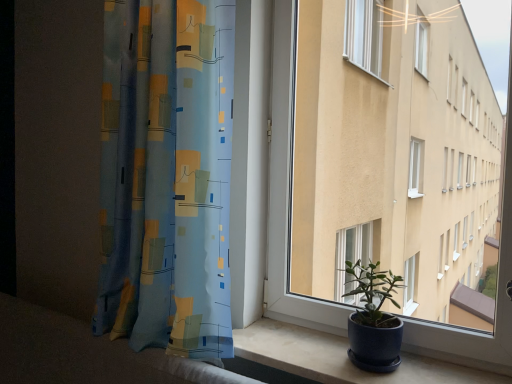
Question: Is blue fabric curtain at left facing towards matte concrete window sill at lower right?

Choices:
 (A) yes
 (B) no

Answer: (B)

Question: Can you see blue fabric curtain at left touching matte concrete window sill at lower right?

Choices:
 (A) no
 (B) yes

Answer: (A)

Question: Considering the relative sizes of blue fabric curtain at left and matte concrete window sill at lower right in the image provided, is blue fabric curtain at left smaller than matte concrete window sill at lower right?

Choices:
 (A) yes
 (B) no

Answer: (B)

Question: Does blue fabric curtain at left have a larger size compared to matte concrete window sill at lower right?

Choices:
 (A) yes
 (B) no

Answer: (A)

Question: Is blue fabric curtain at left in front of matte concrete window sill at lower right?

Choices:
 (A) no
 (B) yes

Answer: (A)

Question: Is blue fabric curtain at left to the left of matte concrete window sill at lower right from the viewer's perspective?

Choices:
 (A) yes
 (B) no

Answer: (A)

Question: Are blue fabric curtain at left and matte white window at center far apart?

Choices:
 (A) no
 (B) yes

Answer: (A)

Question: Can you confirm if blue fabric curtain at left is bigger than matte white window at center?

Choices:
 (A) yes
 (B) no

Answer: (A)

Question: Can you confirm if blue fabric curtain at left is shorter than matte white window at center?

Choices:
 (A) yes
 (B) no

Answer: (B)

Question: Can we say blue fabric curtain at left lies outside matte white window at center?

Choices:
 (A) yes
 (B) no

Answer: (A)

Question: Considering the relative sizes of blue fabric curtain at left and matte white window at center in the image provided, is blue fabric curtain at left smaller than matte white window at center?

Choices:
 (A) yes
 (B) no

Answer: (B)

Question: Considering the relative positions of blue fabric curtain at left and matte white window at center in the image provided, is blue fabric curtain at left to the right of matte white window at center from the viewer's perspective?

Choices:
 (A) no
 (B) yes

Answer: (A)

Question: Could you tell me if matte white window at center is facing blue fabric curtain at left?

Choices:
 (A) yes
 (B) no

Answer: (B)